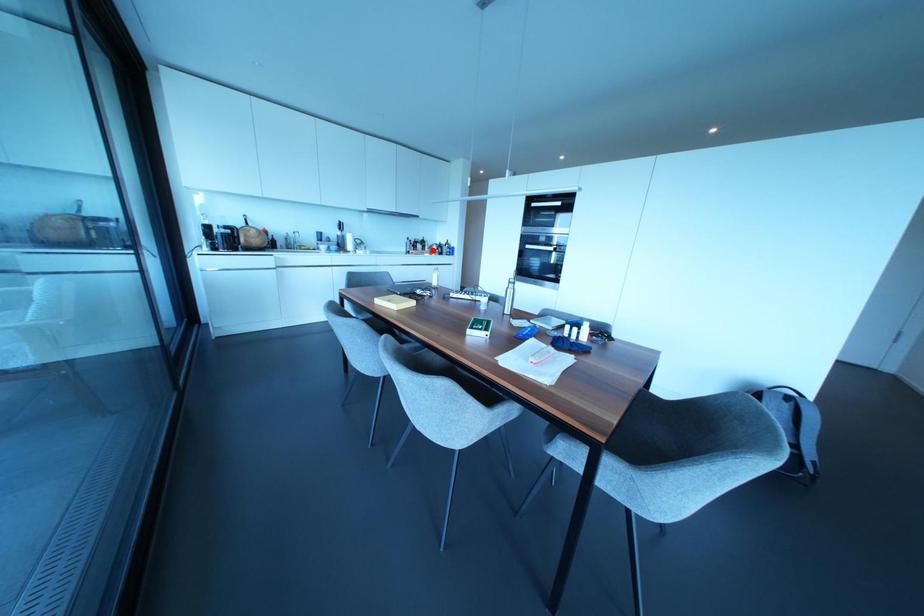
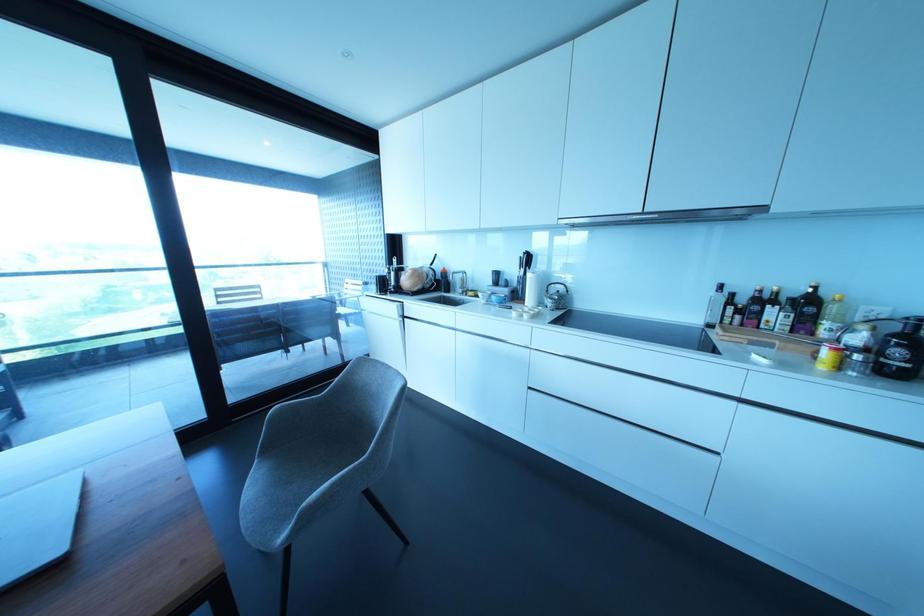
Question: I am providing you with two images of the same scene from different viewpoints. Given a red point in image1, look at the same physical point in image2. Is it:

Choices:
 (A) Closer to the viewpoint
 (B) Farther from the viewpoint

Answer: (B)